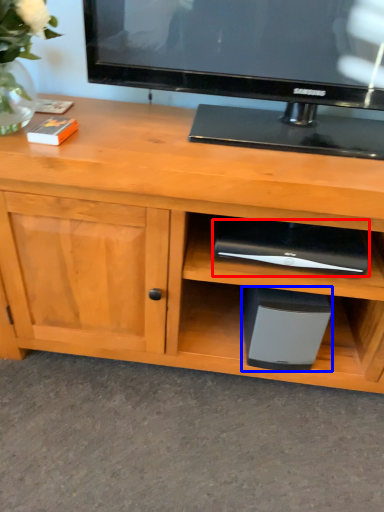
Question: Which point is closer to the camera, appliance (highlighted by a red box) or appliance (highlighted by a blue box)?

Choices:
 (A) appliance
 (B) appliance

Answer: (A)